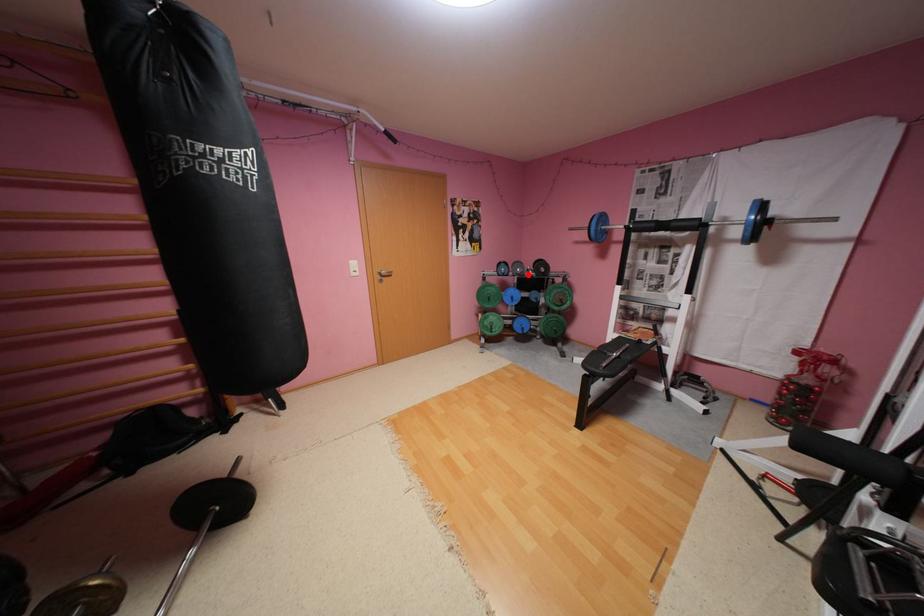
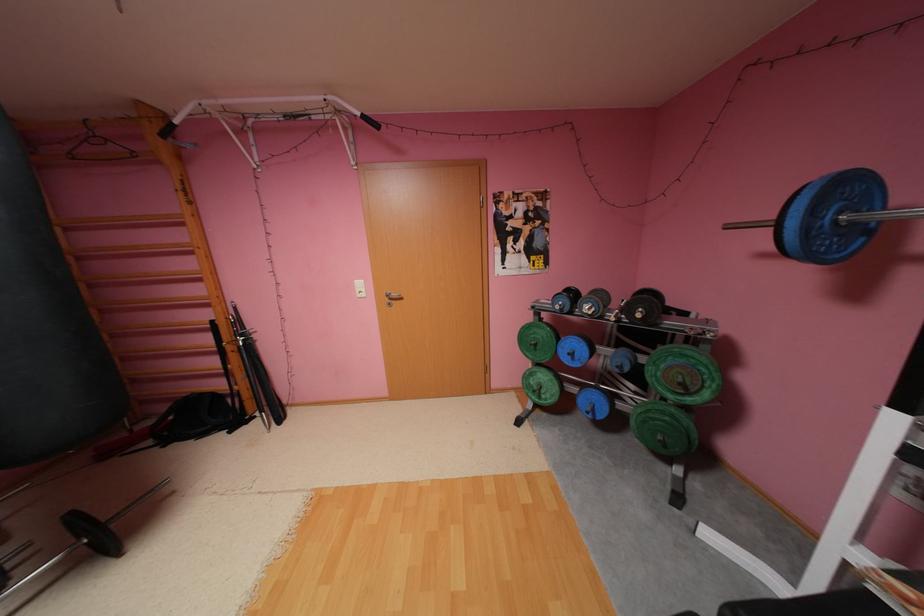
Find the pixel in the second image that matches the highlighted location in the first image.

(600, 315)